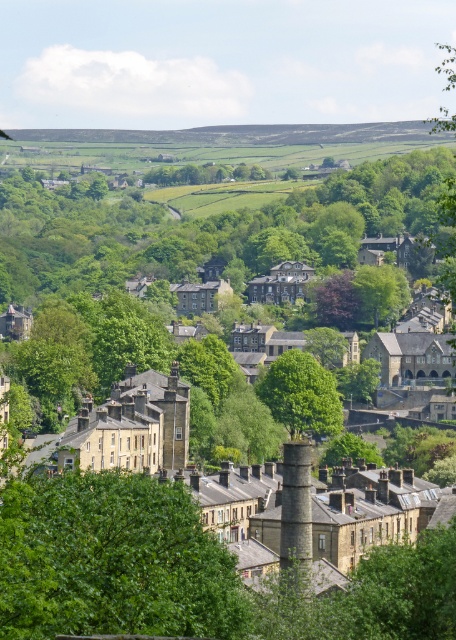
Is green leafy tree at center positioned in front of stone chimney at center?

No.

This screenshot has height=640, width=456. In order to click on green leafy tree at center in this screenshot , I will do `click(300, 394)`.